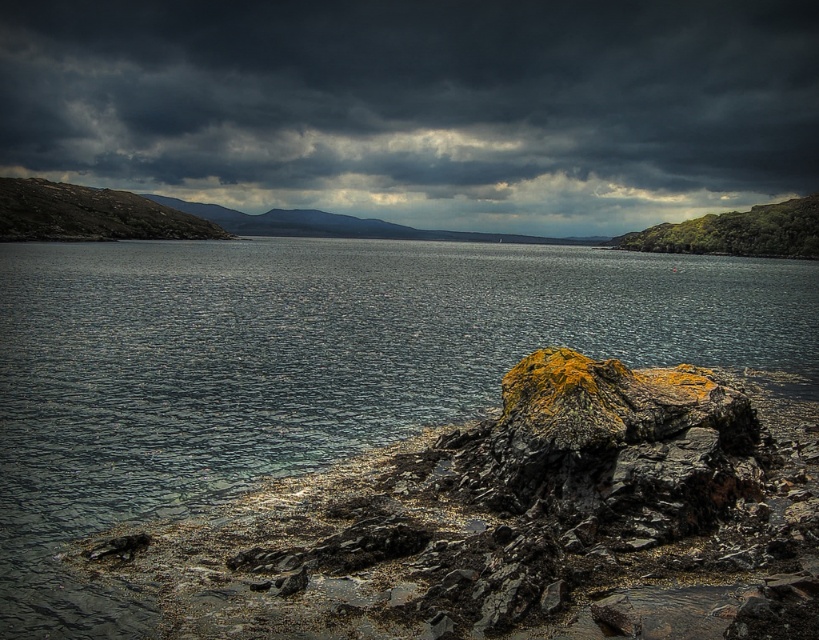
You are a weather observer standing at the coastal area shown in the image. You need to report the exact coordinates of the dark gray cloud at upper center in the image. What are its coordinates?

The dark gray cloud at upper center is located at coordinates point (419, 106).

You are standing at the edge of the rocky terrain in the coastal scene. You see two points marked in the image. Which point is closer to you, point (629, 104) or point (107, 433)?

Point (629, 104) is further to the viewer than point (107, 433), so the closer point is point (107, 433).

You are a weather observer analyzing the coastal scene. You notice the dark gray cloud at upper center and the dark gray water at center. Which of these two objects appears taller in the image?

The dark gray cloud at upper center is taller than the dark gray water at center according to the description.